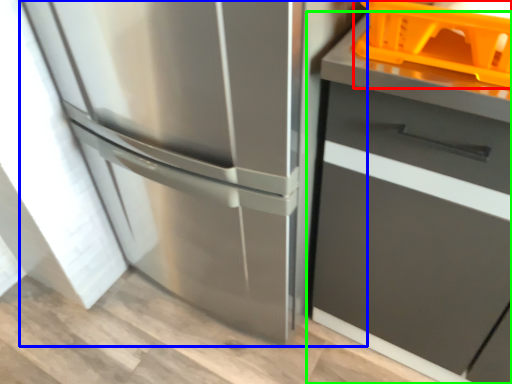
Question: Considering the real-world distances, which object is closest to basket (highlighted by a red box)? refrigerator (highlighted by a blue box) or cabinetry (highlighted by a green box).

Choices:
 (A) refrigerator
 (B) cabinetry

Answer: (B)